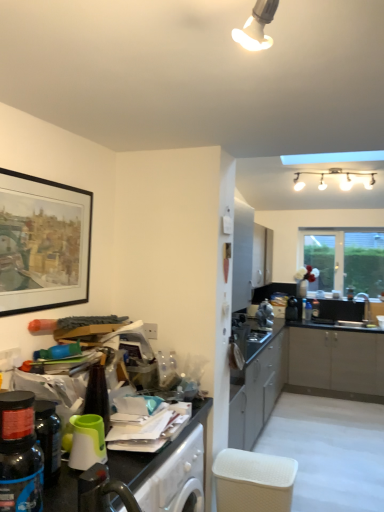
Question: Does point (266, 311) appear closer or farther from the camera than point (1, 177)?

Choices:
 (A) farther
 (B) closer

Answer: (A)

Question: Looking at their shapes, would you say satin silver toaster at center-right, the 2th appliance viewed from the front, is wider or thinner than black matte picture frame at left?

Choices:
 (A) thin
 (B) wide

Answer: (B)

Question: Considering the real-world distances, which object is farthest from the satin silver toaster at center-right, which ranks as the 2th appliance in right-to-left order?

Choices:
 (A) black plastic toaster at center-right, the 3th appliance when ordered from front to back
 (B) white glossy light fixture at upper right
 (C) black matte picture frame at left
 (D) translucent plastic bottle at lower left
 (E) white textured basket at lower center

Answer: (D)

Question: Estimate the real-world distances between objects in this image. Which object is closer to the white glossy light fixture at upper right?

Choices:
 (A) green plastic cup at lower left, marked as the first appliance in a left-to-right arrangement
 (B) black plastic toaster at center-right, the 1th appliance when ordered from right to left
 (C) clear glass window at upper right
 (D) translucent plastic bottle at lower left
 (E) black matte picture frame at left

Answer: (C)